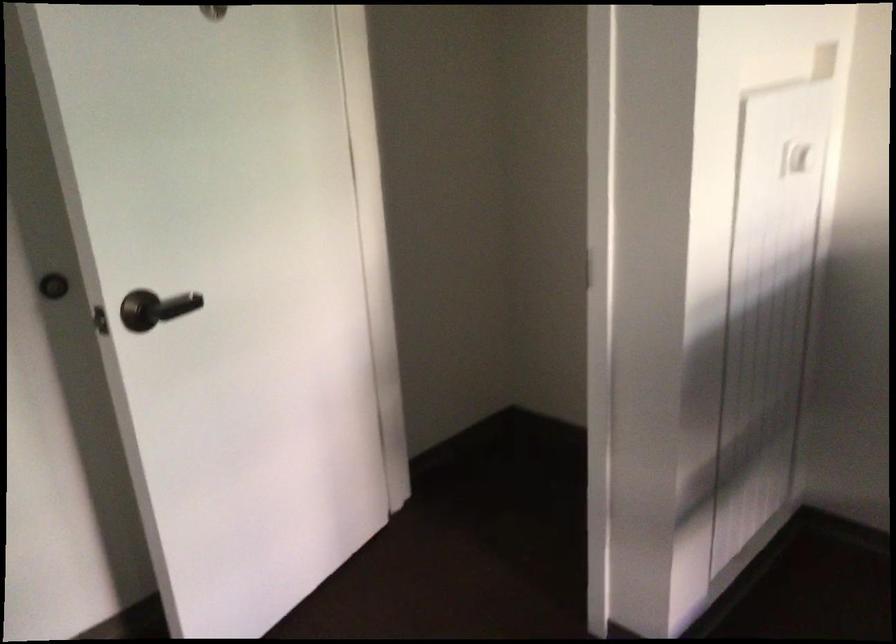
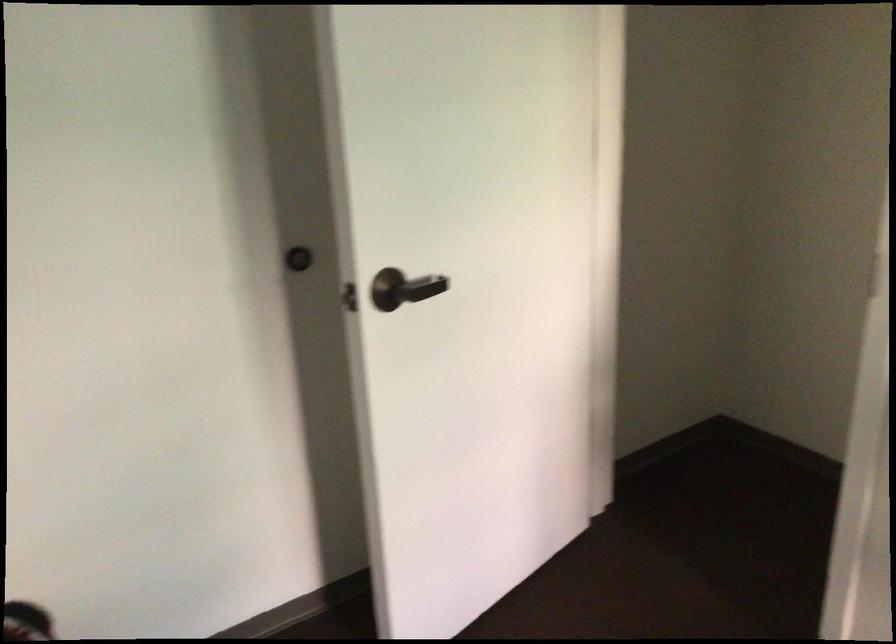
What movement of the cameraman would produce the second image?

The cameraman moved toward left, forward.